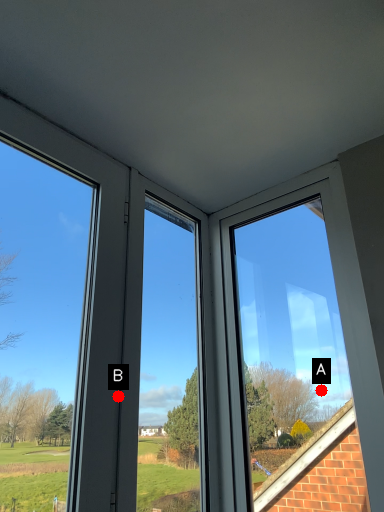
Question: Two points are circled on the image, labeled by A and B beside each circle. Which point is closer to the camera?

Choices:
 (A) A is closer
 (B) B is closer

Answer: (B)